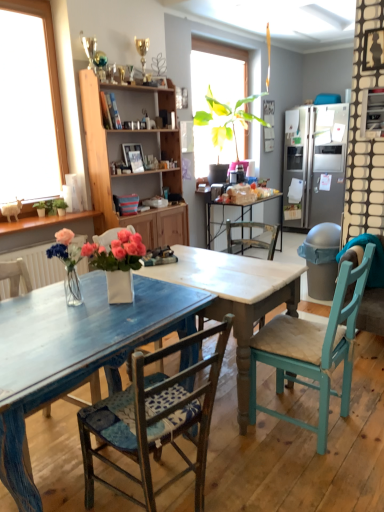
Question: Is white marble table at center taller than blue painted wood table at center?

Choices:
 (A) no
 (B) yes

Answer: (B)

Question: Is blue painted wood table at center at the back of white marble table at center?

Choices:
 (A) no
 (B) yes

Answer: (A)

Question: Is white marble table at center positioned in front of blue painted wood table at center?

Choices:
 (A) no
 (B) yes

Answer: (A)

Question: Does white marble table at center have a greater width compared to blue painted wood table at center?

Choices:
 (A) no
 (B) yes

Answer: (A)

Question: Is white marble table at center located outside blue painted wood table at center?

Choices:
 (A) yes
 (B) no

Answer: (A)

Question: Is white marble table at center bigger than blue painted wood table at center?

Choices:
 (A) no
 (B) yes

Answer: (B)

Question: Is wooden cabinet at center smaller than wooden chair with blue cushion at center, arranged as the 2th chair when viewed from the left?

Choices:
 (A) no
 (B) yes

Answer: (A)

Question: Is wooden cabinet at center directly adjacent to wooden chair with blue cushion at center, arranged as the 2th chair when viewed from the left?

Choices:
 (A) yes
 (B) no

Answer: (B)

Question: Is wooden cabinet at center located outside wooden chair with blue cushion at center, the 2th chair when ordered from right to left?

Choices:
 (A) no
 (B) yes

Answer: (B)

Question: From the image's perspective, is wooden cabinet at center over wooden chair with blue cushion at center, the 2th chair when ordered from right to left?

Choices:
 (A) no
 (B) yes

Answer: (B)

Question: Is wooden cabinet at center bigger than wooden chair with blue cushion at center, arranged as the 2th chair when viewed from the left?

Choices:
 (A) yes
 (B) no

Answer: (A)

Question: Considering the relative sizes of wooden cabinet at center and wooden chair with blue cushion at center, arranged as the 2th chair when viewed from the left, in the image provided, is wooden cabinet at center wider than wooden chair with blue cushion at center, arranged as the 2th chair when viewed from the left,?

Choices:
 (A) yes
 (B) no

Answer: (B)

Question: Considering the relative sizes of distressed blue chair at lower left, which appears as the 3th chair when viewed from the right, and wooden cabinet at center in the image provided, is distressed blue chair at lower left, which appears as the 3th chair when viewed from the right, wider than wooden cabinet at center?

Choices:
 (A) yes
 (B) no

Answer: (A)